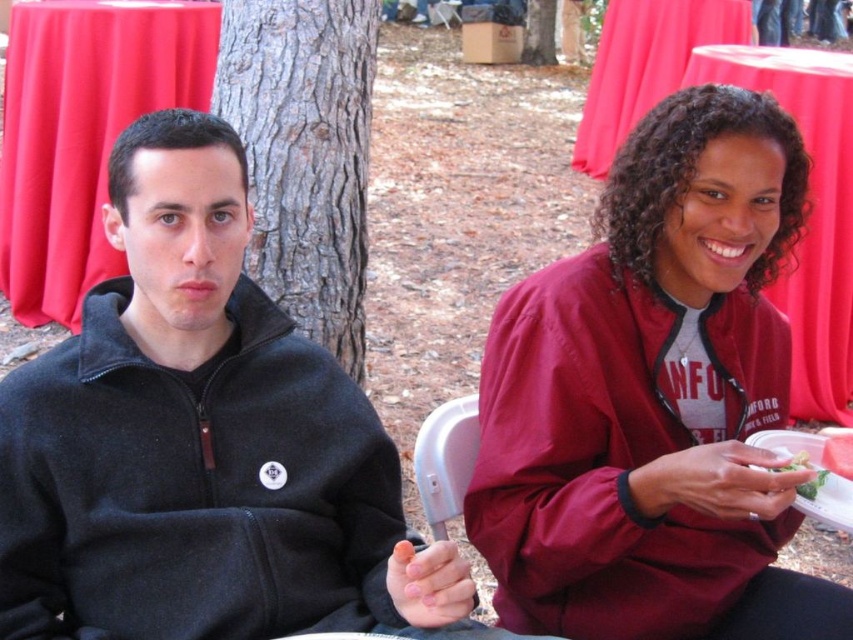
Question: Can you confirm if black fleece sweatshirt at left is bigger than red cloth table at upper center?

Choices:
 (A) no
 (B) yes

Answer: (A)

Question: Is red cloth table at left positioned in front of red cloth table at upper center?

Choices:
 (A) yes
 (B) no

Answer: (B)

Question: Is black fleece sweatshirt at left above green leafy salad at lower right?

Choices:
 (A) yes
 (B) no

Answer: (A)

Question: Considering the real-world distances, which object is farthest from the red fabric table at upper center?

Choices:
 (A) red cloth table at left
 (B) black fleece sweatshirt at left

Answer: (B)

Question: Considering the real-world distances, which object is closest to the green leafy salad at lower right?

Choices:
 (A) burgundy fabric jacket at center
 (B) green leafy vegetable at right

Answer: (B)

Question: Which of these objects is positioned closest to the red fabric table at upper center?

Choices:
 (A) green leafy vegetable at right
 (B) green leafy salad at lower right
 (C) brown rough bark at center
 (D) red cloth table at left

Answer: (D)